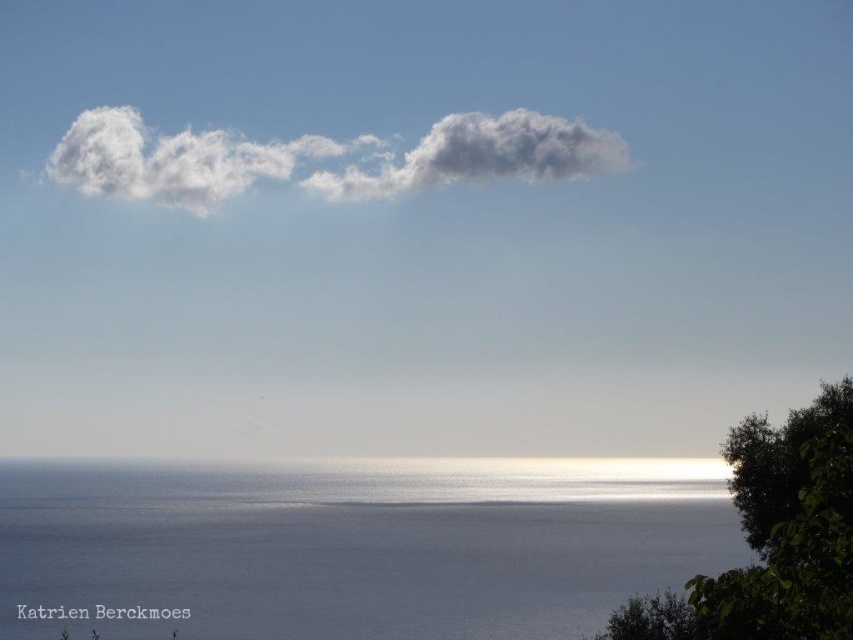
Can you confirm if blue smooth water at lower center is wider than green leafy tree at lower right?

Yes, blue smooth water at lower center is wider than green leafy tree at lower right.

Is blue smooth water at lower center behind green leafy tree at lower right?

Yes.

Who is more distant from viewer, (466,600) or (733,436)?

Point (466,600)

At what (x,y) coordinates should I click in order to perform the action: click on blue smooth water at lower center. Please return your answer as a coordinate pair (x, y). Looking at the image, I should click on (354, 547).

Is point (345, 582) closer to viewer compared to point (531, 116)?

Yes, it is in front of point (531, 116).

Is blue smooth water at lower center smaller than white fluffy cloud at upper center?

No, blue smooth water at lower center is not smaller than white fluffy cloud at upper center.

Is point (82, 596) closer to viewer compared to point (515, 124)?

Yes.

Image resolution: width=853 pixels, height=640 pixels. I want to click on blue smooth water at lower center, so coord(354,547).

Which is below, white fluffy cloud at upper center or green leafy tree at lower right?

Positioned lower is green leafy tree at lower right.

Does white fluffy cloud at upper center lie in front of green leafy tree at lower right?

No, white fluffy cloud at upper center is further to the viewer.

Locate an element on the screen. Image resolution: width=853 pixels, height=640 pixels. white fluffy cloud at upper center is located at coordinates (323, 157).